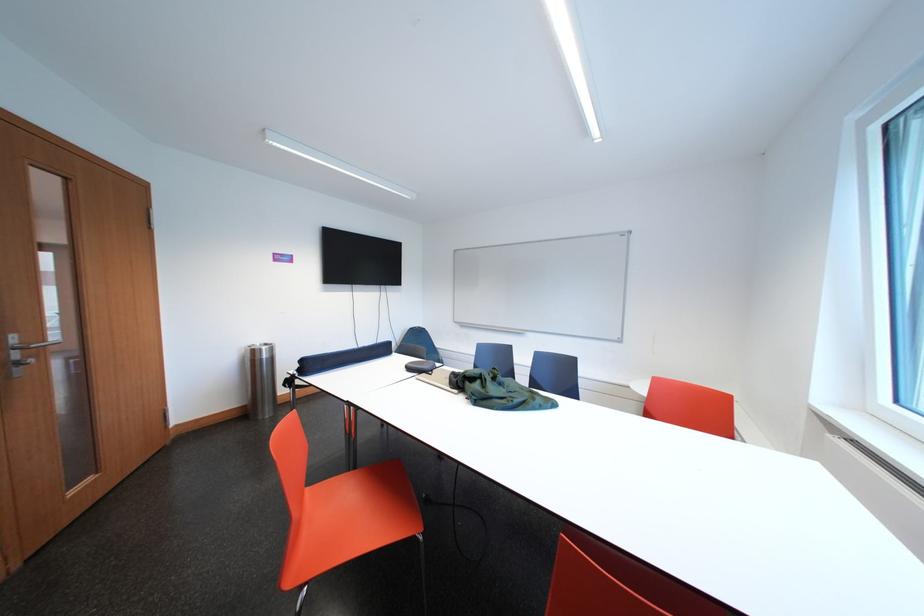
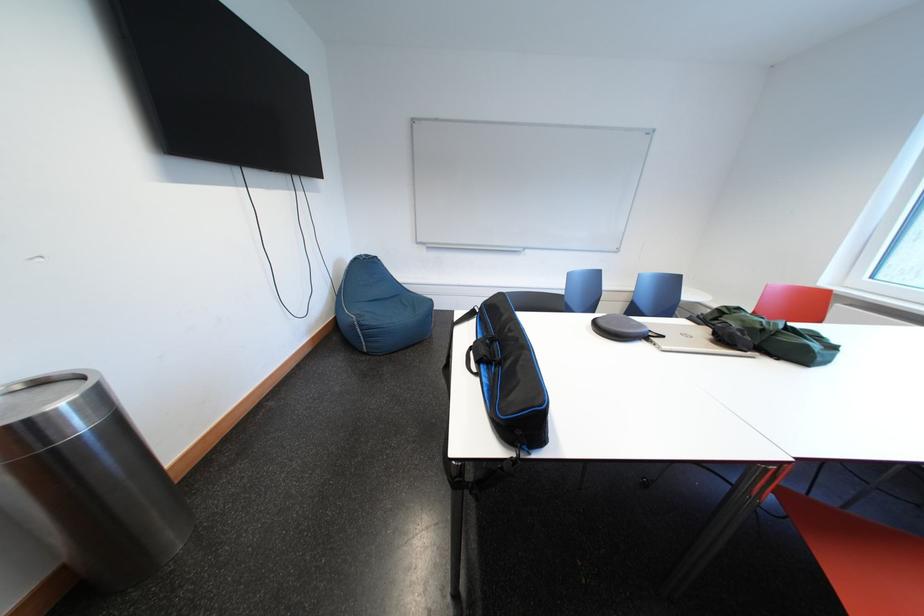
In the second image, find the point that corresponds to pixel 263 357 in the first image.

(30, 439)